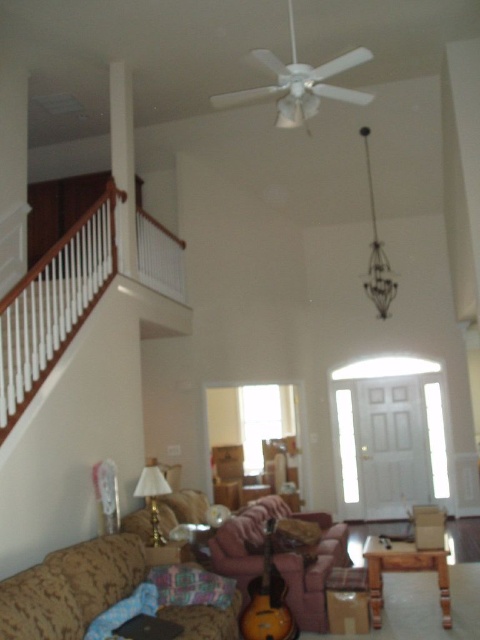
Question: Is brown textured couch at lower left smaller than velvet pink pillow at lower center?

Choices:
 (A) no
 (B) yes

Answer: (A)

Question: Is brown textured couch at lower left smaller than brown fabric couch at center?

Choices:
 (A) no
 (B) yes

Answer: (B)

Question: Among these points, which one is nearest to the camera?

Choices:
 (A) (211, 580)
 (B) (264, 556)
 (C) (374, 604)
 (D) (108, 579)

Answer: (D)

Question: Which point is closer to the camera taking this photo?

Choices:
 (A) (404, 572)
 (B) (228, 536)

Answer: (A)

Question: In this image, where is brown fabric couch at center located relative to sunburst wood guitar at lower center?

Choices:
 (A) below
 (B) above

Answer: (A)

Question: Estimate the real-world distances between objects in this image. Which object is closer to the sunburst wood guitar at lower center?

Choices:
 (A) wooden coffee table at lower center
 (B) brown textured couch at lower left
 (C) velvet pink pillow at lower center
 (D) brown fabric couch at center

Answer: (C)